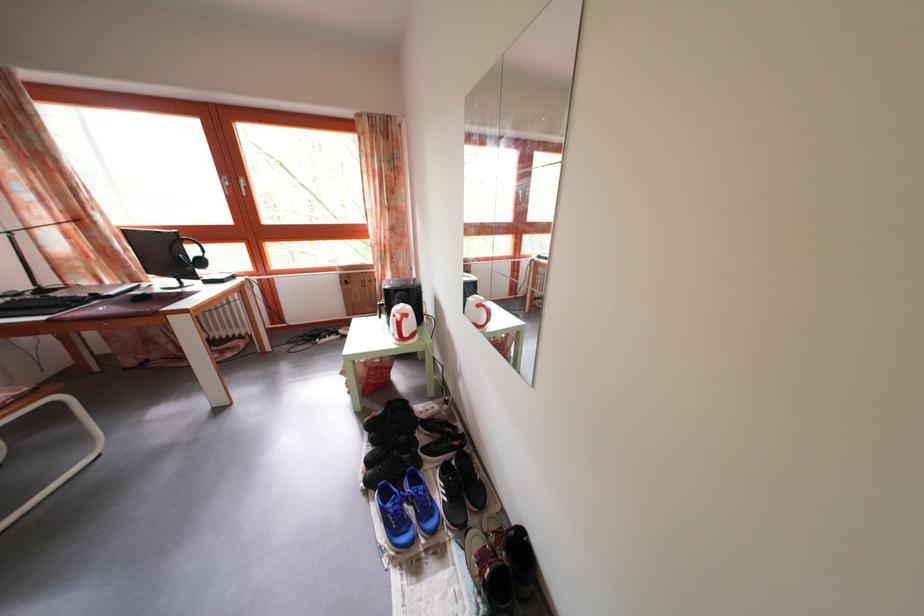
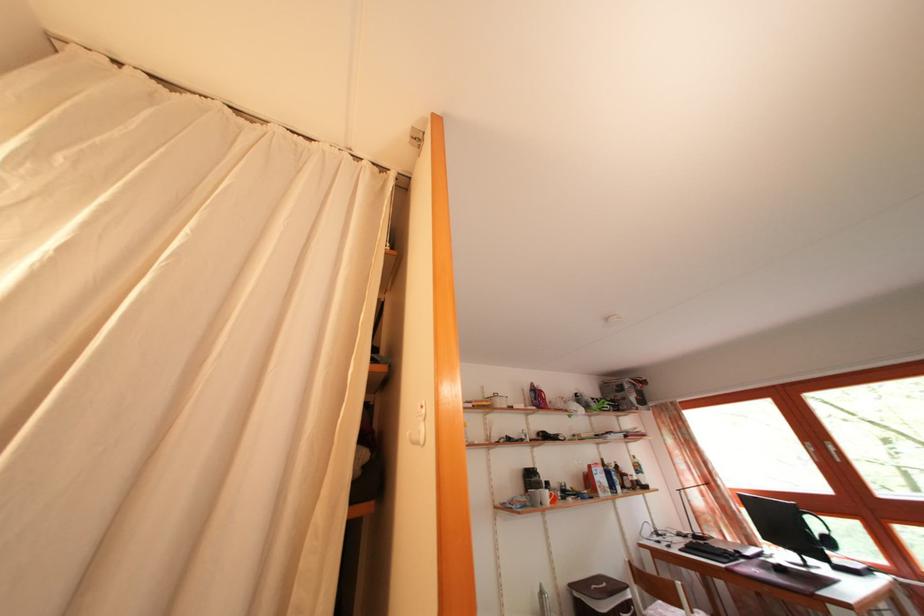
Find the pixel in the second image that matches point 209,270 in the first image.

(837, 549)